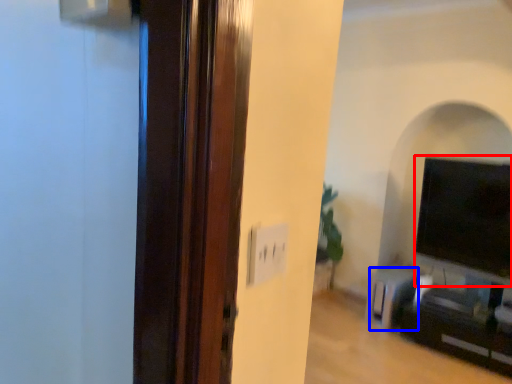
Question: Which object appears farthest to the camera in this image, wide (highlighted by a red box) or furniture (highlighted by a blue box)?

Choices:
 (A) wide
 (B) furniture

Answer: (B)